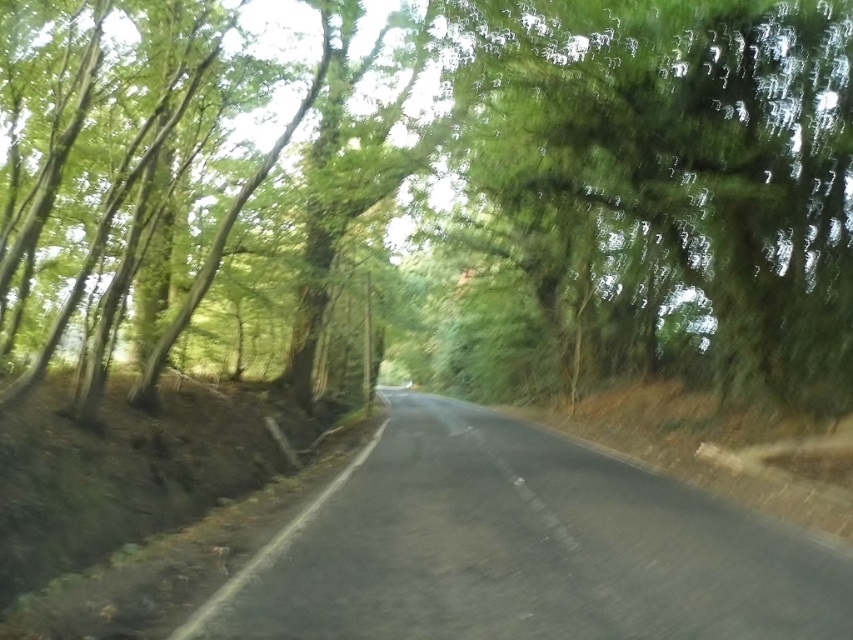
This screenshot has width=853, height=640. Describe the element at coordinates (669, 196) in the screenshot. I see `green leafy tree at upper center` at that location.

Between green leafy tree at upper center and black asphalt road at center, which one has less height?

Standing shorter between the two is black asphalt road at center.

At what (x,y) coordinates should I click in order to perform the action: click on green leafy tree at upper center. Please return your answer as a coordinate pair (x, y). The width and height of the screenshot is (853, 640). Looking at the image, I should click on (669, 196).

The image size is (853, 640). I want to click on green leafy tree at upper center, so click(669, 196).

Is green leafy tree at center positioned in front of black asphalt road at center?

No, it is behind black asphalt road at center.

Does green leafy tree at center appear under black asphalt road at center?

Actually, green leafy tree at center is above black asphalt road at center.

What do you see at coordinates (451, 184) in the screenshot? I see `green leafy tree at center` at bounding box center [451, 184].

Image resolution: width=853 pixels, height=640 pixels. Identify the location of green leafy tree at center. [451, 184].

Does green leafy tree at center appear on the right side of green leafy tree at upper center?

In fact, green leafy tree at center is to the left of green leafy tree at upper center.

Is green leafy tree at center smaller than green leafy tree at upper center?

Actually, green leafy tree at center might be larger than green leafy tree at upper center.

Which is in front, point (6, 36) or point (769, 177)?

Point (6, 36)

Identify the location of green leafy tree at center. The image size is (853, 640). (451, 184).